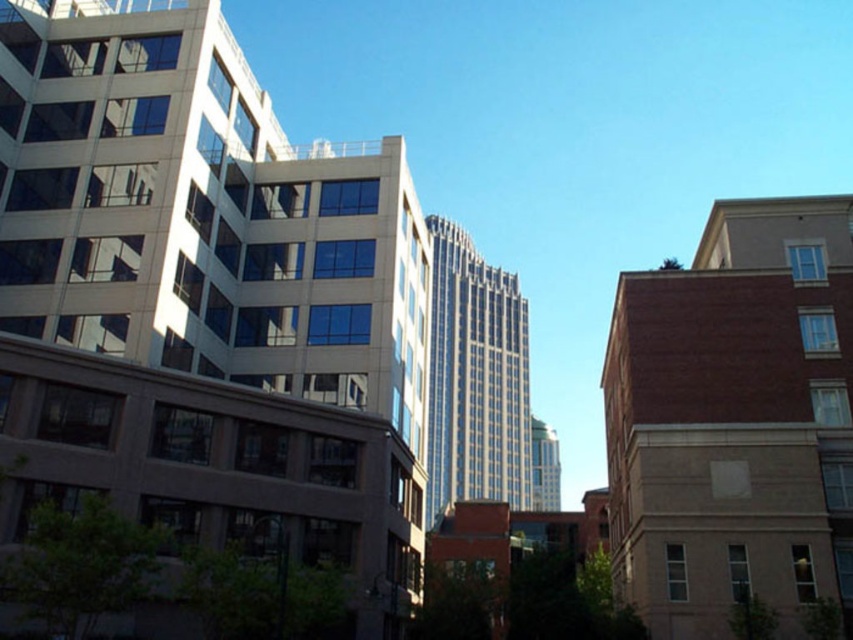
Question: Is matte glass building at center wider than glassy silver skyscraper at center?

Choices:
 (A) no
 (B) yes

Answer: (A)

Question: Among these points, which one is farthest from the camera?

Choices:
 (A) (357, 420)
 (B) (444, 312)

Answer: (B)

Question: Can you confirm if matte glass building at center is positioned below glassy silver skyscraper at center?

Choices:
 (A) yes
 (B) no

Answer: (B)

Question: Which point is farther to the camera?

Choices:
 (A) glassy silver skyscraper at center
 (B) matte glass building at center

Answer: (A)

Question: Observing the image, what is the correct spatial positioning of matte glass building at center in reference to glassy silver skyscraper at center?

Choices:
 (A) above
 (B) below

Answer: (A)